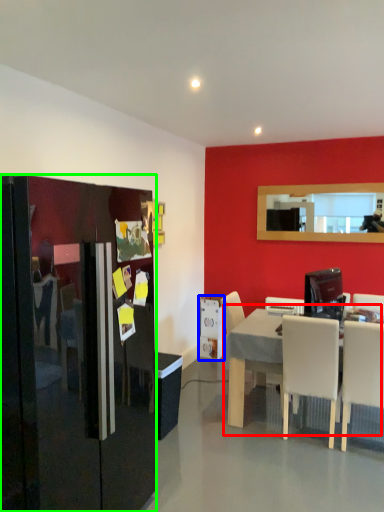
Question: Which object is positioned farthest from table (highlighted by a red box)? Select from appliance (highlighted by a blue box) and refrigerator (highlighted by a green box).

Choices:
 (A) appliance
 (B) refrigerator

Answer: (A)